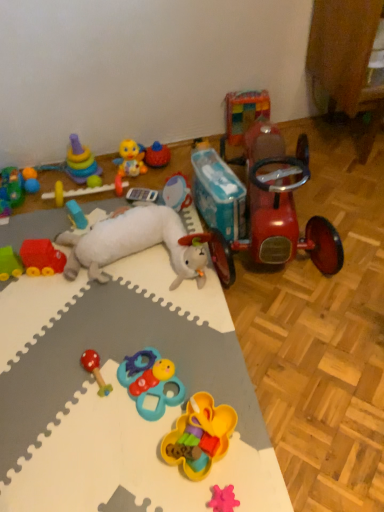
Image resolution: width=384 pixels, height=512 pixels. I want to click on vacant space situated on the left part of multicolored plastic rings at upper left, marked as the 2th toy in a left-to-right arrangement, so click(x=51, y=186).